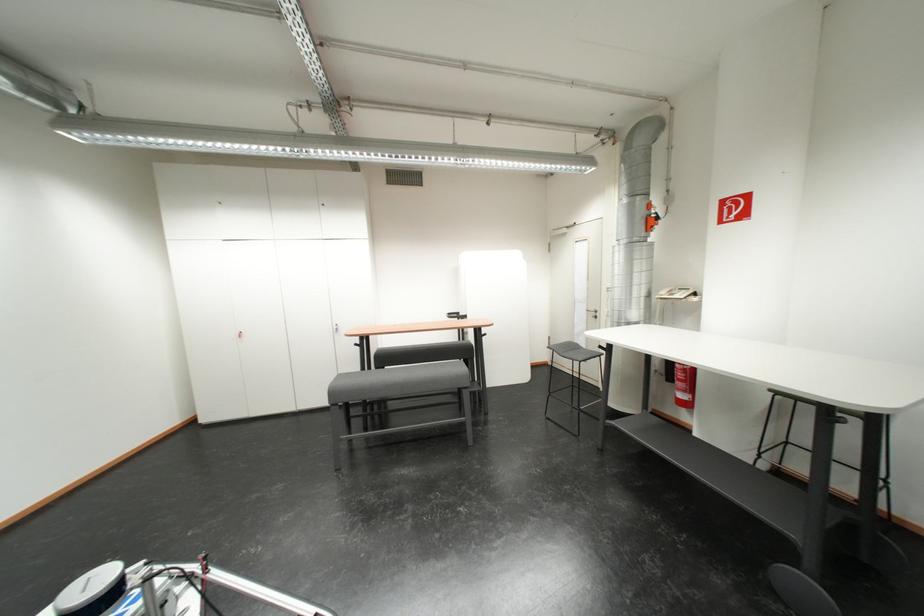
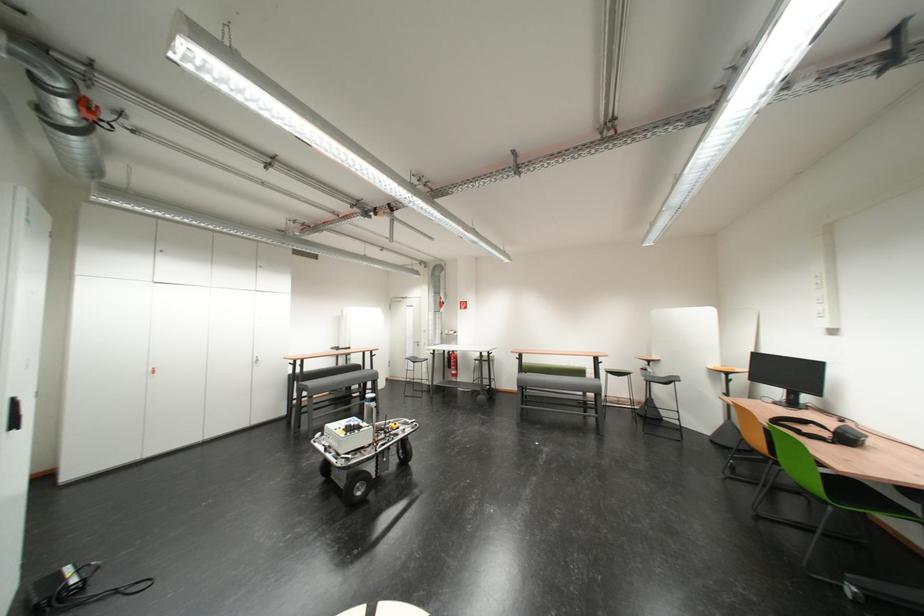
Where in the second image is the point corresponding to (588,323) from the first image?

(419, 351)